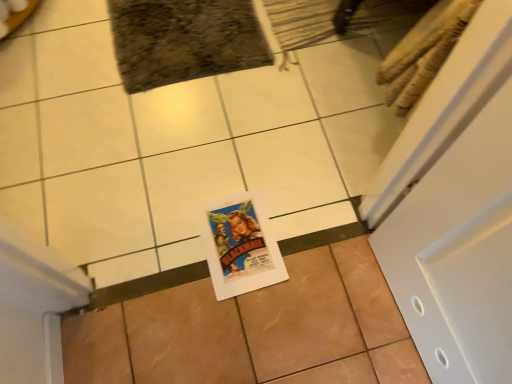
Question: Are brown glossy tile at center, which ranks as the 2th ceramic tile in top-to-bottom order, and brown glossy tile at center, placed as the first ceramic tile when sorted from top to bottom, far apart?

Choices:
 (A) yes
 (B) no

Answer: (B)

Question: Considering the relative sizes of brown glossy tile at center, which ranks as the 1th ceramic tile in bottom-to-top order, and brown glossy tile at center, which ranks as the second ceramic tile in bottom-to-top order, in the image provided, is brown glossy tile at center, which ranks as the 1th ceramic tile in bottom-to-top order, bigger than brown glossy tile at center, which ranks as the second ceramic tile in bottom-to-top order,?

Choices:
 (A) yes
 (B) no

Answer: (B)

Question: Considering the relative sizes of brown glossy tile at center, which ranks as the 1th ceramic tile in bottom-to-top order, and brown glossy tile at center, placed as the first ceramic tile when sorted from top to bottom, in the image provided, is brown glossy tile at center, which ranks as the 1th ceramic tile in bottom-to-top order, wider than brown glossy tile at center, placed as the first ceramic tile when sorted from top to bottom,?

Choices:
 (A) no
 (B) yes

Answer: (A)

Question: Is brown glossy tile at center, which ranks as the 2th ceramic tile in top-to-bottom order, smaller than brown glossy tile at center, which ranks as the second ceramic tile in bottom-to-top order?

Choices:
 (A) yes
 (B) no

Answer: (A)

Question: Can you confirm if brown glossy tile at center, which ranks as the 1th ceramic tile in bottom-to-top order, is thinner than brown glossy tile at center, which ranks as the second ceramic tile in bottom-to-top order?

Choices:
 (A) yes
 (B) no

Answer: (A)

Question: From the image's perspective, is brown glossy tile at center, which ranks as the 1th ceramic tile in bottom-to-top order, on brown glossy tile at center, placed as the first ceramic tile when sorted from top to bottom?

Choices:
 (A) no
 (B) yes

Answer: (A)

Question: Is brown glossy tile at center, which ranks as the second ceramic tile in bottom-to-top order, taller than brown glossy tile at center, which ranks as the 1th ceramic tile in bottom-to-top order?

Choices:
 (A) no
 (B) yes

Answer: (B)

Question: Is brown glossy tile at center, placed as the first ceramic tile when sorted from top to bottom, not near brown glossy tile at center, which ranks as the 2th ceramic tile in top-to-bottom order?

Choices:
 (A) yes
 (B) no

Answer: (B)

Question: Can you confirm if brown glossy tile at center, placed as the first ceramic tile when sorted from top to bottom, is shorter than brown glossy tile at center, which ranks as the 2th ceramic tile in top-to-bottom order?

Choices:
 (A) yes
 (B) no

Answer: (B)

Question: From a real-world perspective, is brown glossy tile at center, which ranks as the second ceramic tile in bottom-to-top order, on top of brown glossy tile at center, which ranks as the 2th ceramic tile in top-to-bottom order?

Choices:
 (A) no
 (B) yes

Answer: (B)

Question: Does brown glossy tile at center, placed as the first ceramic tile when sorted from top to bottom, come behind brown glossy tile at center, which ranks as the 1th ceramic tile in bottom-to-top order?

Choices:
 (A) yes
 (B) no

Answer: (A)

Question: Considering the relative sizes of brown glossy tile at center, placed as the first ceramic tile when sorted from top to bottom, and brown glossy tile at center, which ranks as the 1th ceramic tile in bottom-to-top order, in the image provided, is brown glossy tile at center, placed as the first ceramic tile when sorted from top to bottom, thinner than brown glossy tile at center, which ranks as the 1th ceramic tile in bottom-to-top order,?

Choices:
 (A) yes
 (B) no

Answer: (B)

Question: Based on their positions, is brown glossy tile at center, placed as the first ceramic tile when sorted from top to bottom, located to the left or right of brown glossy tile at center, which ranks as the 1th ceramic tile in bottom-to-top order?

Choices:
 (A) left
 (B) right

Answer: (A)